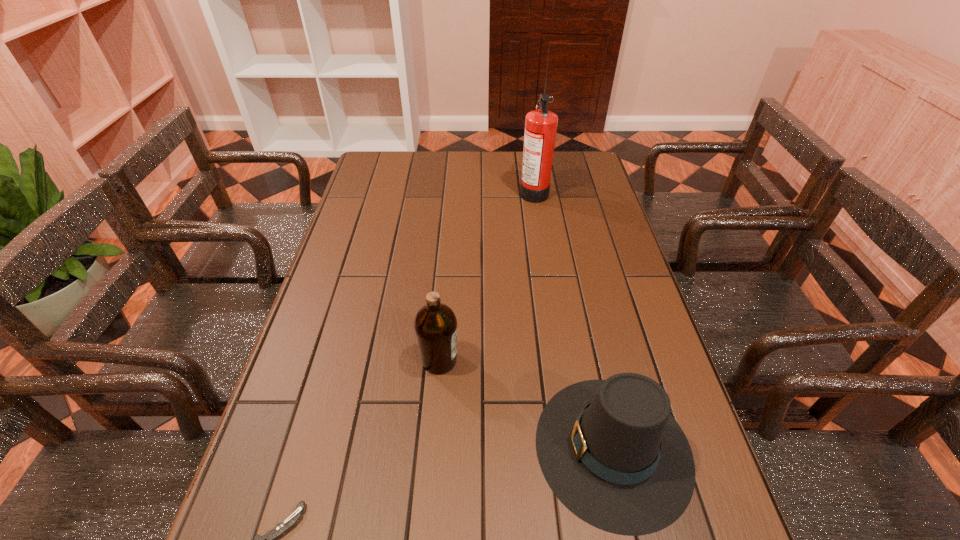
Find the location of `free space located 0.240m on the front-facing side of the hat`. free space located 0.240m on the front-facing side of the hat is located at coordinates (418, 448).

At what (x,y) coordinates should I click in order to perform the action: click on free space located on the front-facing side of the hat. Please return your answer as a coordinate pair (x, y). This screenshot has height=540, width=960. Looking at the image, I should click on (471, 448).

Find the location of a particular element. This screenshot has width=960, height=540. object that is positioned at the far edge is located at coordinates (541, 124).

The height and width of the screenshot is (540, 960). I want to click on object that is at the right edge, so click(611, 452).

Where is `vacant space at the far edge of the desktop`? This screenshot has height=540, width=960. vacant space at the far edge of the desktop is located at coordinates (445, 169).

Find the location of a particular element. vacant region at the left edge of the desktop is located at coordinates (321, 319).

I want to click on vacant area at the right edge, so click(574, 200).

Locate an element on the screen. This screenshot has width=960, height=540. free space at the far left corner is located at coordinates (381, 168).

Where is `free space between the second shortest object and the fire extinguisher`? The height and width of the screenshot is (540, 960). free space between the second shortest object and the fire extinguisher is located at coordinates (573, 320).

This screenshot has width=960, height=540. I want to click on free space between the fire extinguisher and the third nearest object, so click(x=487, y=276).